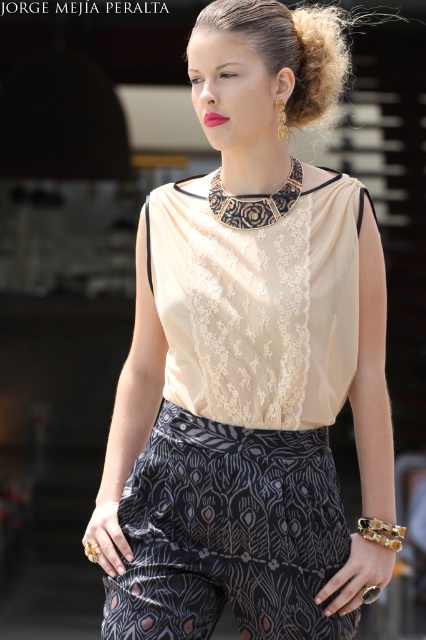
What are the coordinates of the dark gray printed pants at center?

The dark gray printed pants at center are located at coordinates point (227,532).

You are a photographer setting up for a portrait shoot. You want to ensure that both the dark gray printed pants at center and the blonde hair at upper center are in focus. Given that your camera can only focus on one plane, which object should you focus on to ensure both are sharp?

You should focus on the dark gray printed pants at center because it is closer to the viewer than the blonde hair at upper center. By focusing on the closer object, the depth of field will extend backward, potentially keeping both in focus.

Based on the description, can you determine which object is located lower on the person, the dark gray printed pants at center or the black lace neckband at center?

The dark gray printed pants at center is positioned under the black lace neckband at center, so the dark gray printed pants at center is located lower on the person.